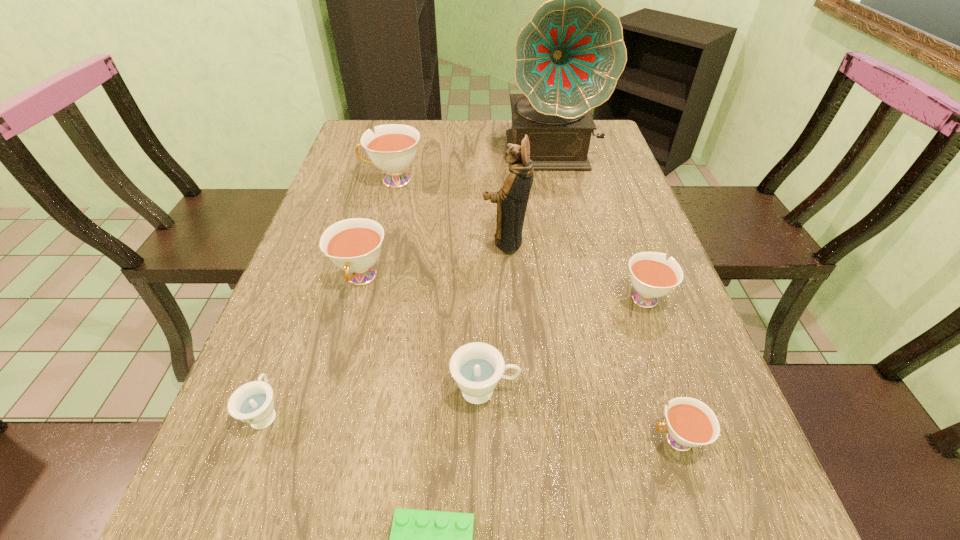
Where is `free space between the nearest white teacup and the smaller blue teacup`? free space between the nearest white teacup and the smaller blue teacup is located at coordinates (470, 426).

This screenshot has width=960, height=540. In order to click on object that ranks as the closest to the Lego in this screenshot , I will do `click(476, 367)`.

Image resolution: width=960 pixels, height=540 pixels. Find the location of `object that is the fourth closest to the smaller blue teacup`. object that is the fourth closest to the smaller blue teacup is located at coordinates (512, 198).

Identify which teacup is the fifth nearest to the green Lego. Please provide its 2D coordinates. Your answer should be formatted as a tuple, i.e. [(x, y)], where the tuple contains the x and y coordinates of a point satisfying the conditions above.

[(652, 276)]

The height and width of the screenshot is (540, 960). Find the location of `the closest teacup relative to the smaller blue teacup`. the closest teacup relative to the smaller blue teacup is located at coordinates (354, 245).

Identify which white teacup is located as the second nearest to the third biggest white teacup. Please provide its 2D coordinates. Your answer should be formatted as a tuple, i.e. [(x, y)], where the tuple contains the x and y coordinates of a point satisfying the conditions above.

[(354, 245)]

The image size is (960, 540). I want to click on white teacup that is the fourth closest to the smaller blue teacup, so click(652, 276).

Locate an element on the screen. vacant space that satisfies the following two spatial constraints: 1. on the horn of the record player; 2. on the side of the fourth teacup from left to right with the handle is located at coordinates (607, 390).

Locate an element on the screen. free space that satisfies the following two spatial constraints: 1. on the front-facing side of the second tallest object; 2. on the side of the second tallest teacup with the handle is located at coordinates (507, 278).

Where is `free space that satisfies the following two spatial constraints: 1. on the side of the biggest white teacup with the handle; 2. on the side of the second smallest white teacup with the handle`? free space that satisfies the following two spatial constraints: 1. on the side of the biggest white teacup with the handle; 2. on the side of the second smallest white teacup with the handle is located at coordinates (364, 296).